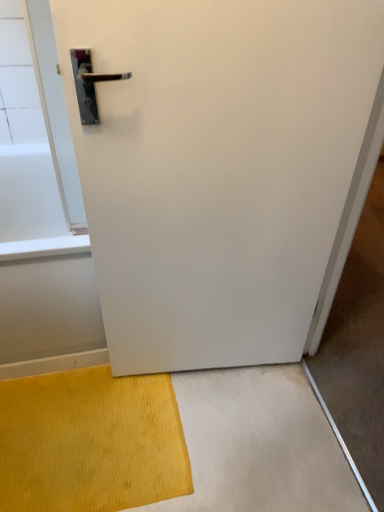
The width and height of the screenshot is (384, 512). In order to click on free spot below yellow textured mat at lower left (from a real-world perspective) in this screenshot , I will do click(75, 444).